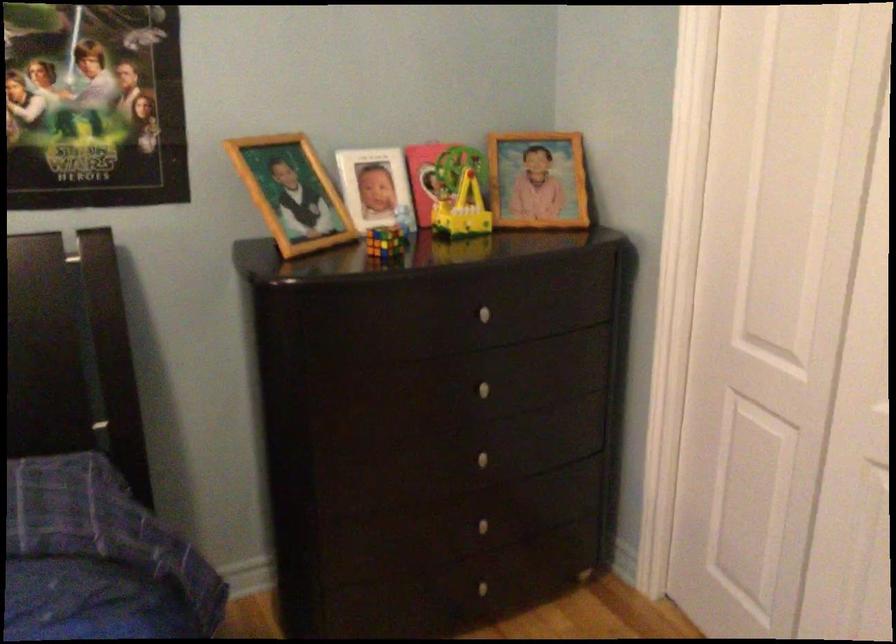
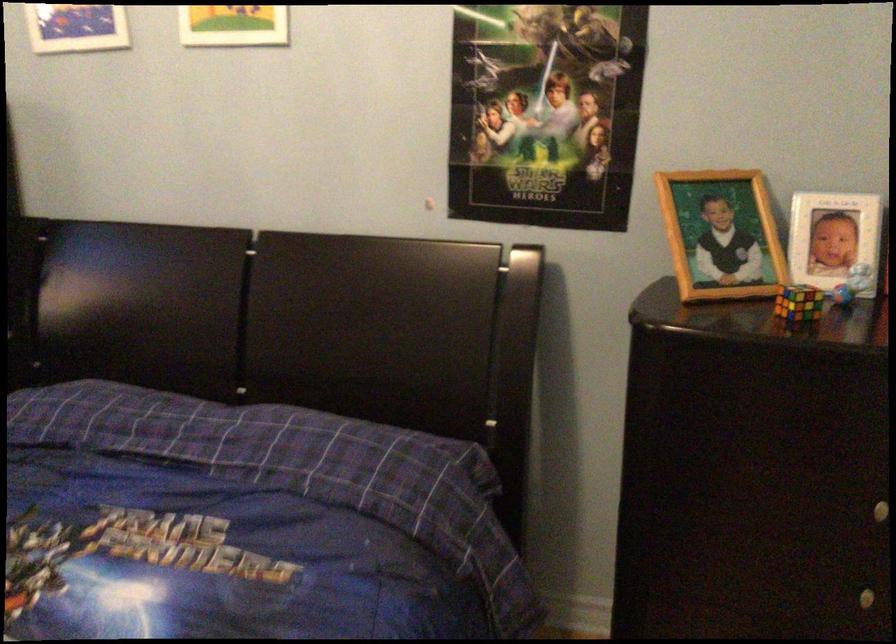
Find the pixel in the second image that matches the point at 386,237 in the first image.

(798, 303)